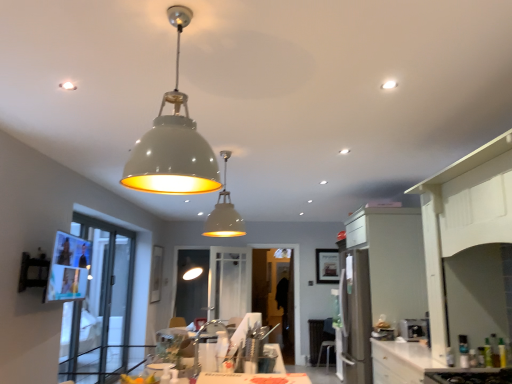
At what (x,y) coordinates should I click in order to perform the action: click on free space above matte white dome at center, the second lamp when ordered from back to front (from a real-world perspective). Please return your answer as a coordinate pair (x, y). This screenshot has height=384, width=512. Looking at the image, I should click on (178, 13).